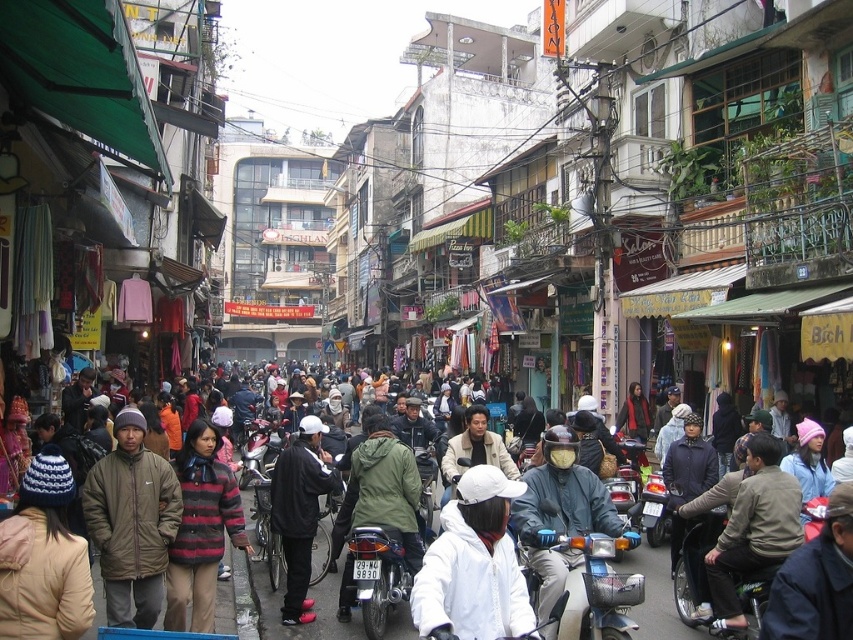
You are a photographer standing in the middle of the street and want to take a photo of both the white knit hat at center and the striped woolen sweater at center. Which object should you focus on first to ensure both are in frame?

The white knit hat at center is not as tall as the striped woolen sweater at center, so you should focus on the striped woolen sweater at center first to ensure both are in frame.

You are standing on the sidewalk in the middle of the street scene. There is a white matte jacket at center located at point (473, 564). If you want to pick it up, which direction should you move relative to the street layout?

The white matte jacket at center is located at point (473, 564), so you should move towards the center of the street to reach it.

You are standing on the street and want to reach a destination located at point (204, 582). There is an obstacle at point (482, 524). Which point should you avoid to reach your destination safely?

You should avoid the obstacle at point (482, 524) because it is closer to you than the destination at point (204, 582), so navigating around it first would ensure a safer path.